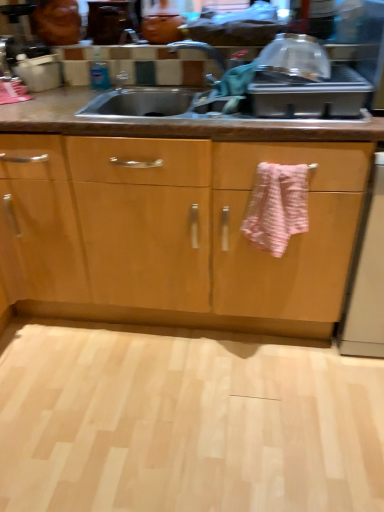
At what (x,y) coordinates should I click in order to perform the action: click on white glossy dishwasher at right. Please return your answer as a coordinate pair (x, y). Looking at the image, I should click on (366, 278).

Image resolution: width=384 pixels, height=512 pixels. What do you see at coordinates (185, 423) in the screenshot?
I see `light wood floor at lower center` at bounding box center [185, 423].

You are a GUI agent. You are given a task and a screenshot of the screen. Output one action in this format:
    pyautogui.click(x=<x>, y=<y>)
    Task: Click on the pink textured towel at center
    This screenshot has height=512, width=384.
    Given the screenshot: What is the action you would take?
    pyautogui.click(x=277, y=206)

Measure the distance between pink textured towel at center and white glossy dishwasher at right.

The distance of pink textured towel at center from white glossy dishwasher at right is 12.73 inches.

Is point (268, 201) less distant than point (376, 202)?

That is True.

Is pink textured towel at center not near white glossy dishwasher at right?

That's not correct — pink textured towel at center is a little close to white glossy dishwasher at right.

From a real-world perspective, which object stands above the other?

pink textured towel at center, from a real-world perspective.

Which of these two, white glossy dishwasher at right or pink textured towel at center, is bigger?

white glossy dishwasher at right.

Identify the location of dish washer that is below the pink textured towel at center (from the image's perspective). coord(366,278).

Identify the location of dish washer behind the light wood floor at lower center. This screenshot has height=512, width=384. (x=366, y=278).

Does light wood floor at lower center turn towards white glossy dishwasher at right?

No, light wood floor at lower center is not oriented towards white glossy dishwasher at right.

Is light wood floor at lower center beside white glossy dishwasher at right?

No.

Consider the image. Is light wood floor at lower center wider than white glossy dishwasher at right?

Yes.

Which is behind, point (273, 246) or point (382, 426)?

Positioned behind is point (273, 246).

Based on the photo, who is shorter, pink textured towel at center or light wood floor at lower center?

With less height is light wood floor at lower center.

Is pink textured towel at center looking in the opposite direction of light wood floor at lower center?

No, pink textured towel at center's orientation is not away from light wood floor at lower center.

Is pink textured towel at center bigger than light wood floor at lower center?

Incorrect, pink textured towel at center is not larger than light wood floor at lower center.

Is pink textured towel at center inside light wood floor at lower center?

No.

In the scene shown: Between light wood floor at lower center and pink textured towel at center, which one is positioned in front?

Positioned in front is light wood floor at lower center.

From a real-world perspective, which is physically below, light wood floor at lower center or pink textured towel at center?

In real-world perspective, light wood floor at lower center is lower.

Considering the relative sizes of light wood floor at lower center and pink textured towel at center in the image provided, is light wood floor at lower center thinner than pink textured towel at center?

In fact, light wood floor at lower center might be wider than pink textured towel at center.

From the image's perspective, is white glossy dishwasher at right on light wood floor at lower center?

Yes.

From a real-world perspective, which object stands above the other?

In real-world perspective, white glossy dishwasher at right is above.

Is white glossy dishwasher at right taller or shorter than light wood floor at lower center?

Considering their sizes, white glossy dishwasher at right has more height than light wood floor at lower center.

The width and height of the screenshot is (384, 512). I want to click on dish washer in front of the pink textured towel at center, so click(x=366, y=278).

Identify the location of bath towel above the white glossy dishwasher at right (from a real-world perspective). (277, 206).

From the image, which object appears to be farther from light wood floor at lower center, white glossy dishwasher at right or pink textured towel at center?

Based on the image, pink textured towel at center appears to be further to light wood floor at lower center.

Based on their spatial positions, is pink textured towel at center or white glossy dishwasher at right closer to light wood floor at lower center?

Among the two, white glossy dishwasher at right is located nearer to light wood floor at lower center.

Based on their spatial positions, is light wood floor at lower center or pink textured towel at center closer to white glossy dishwasher at right?

pink textured towel at center is positioned closer to the anchor white glossy dishwasher at right.

When comparing their distances from white glossy dishwasher at right, does pink textured towel at center or light wood floor at lower center seem closer?

Based on the image, pink textured towel at center appears to be nearer to white glossy dishwasher at right.

Looking at the image, which one is located closer to pink textured towel at center, white glossy dishwasher at right or light wood floor at lower center?

white glossy dishwasher at right is closer to pink textured towel at center.

When comparing their distances from pink textured towel at center, does light wood floor at lower center or white glossy dishwasher at right seem further?

light wood floor at lower center is positioned further to the anchor pink textured towel at center.

What are the coordinates of `bath towel located between light wood floor at lower center and white glossy dishwasher at right in the left-right direction` in the screenshot? It's located at (277, 206).